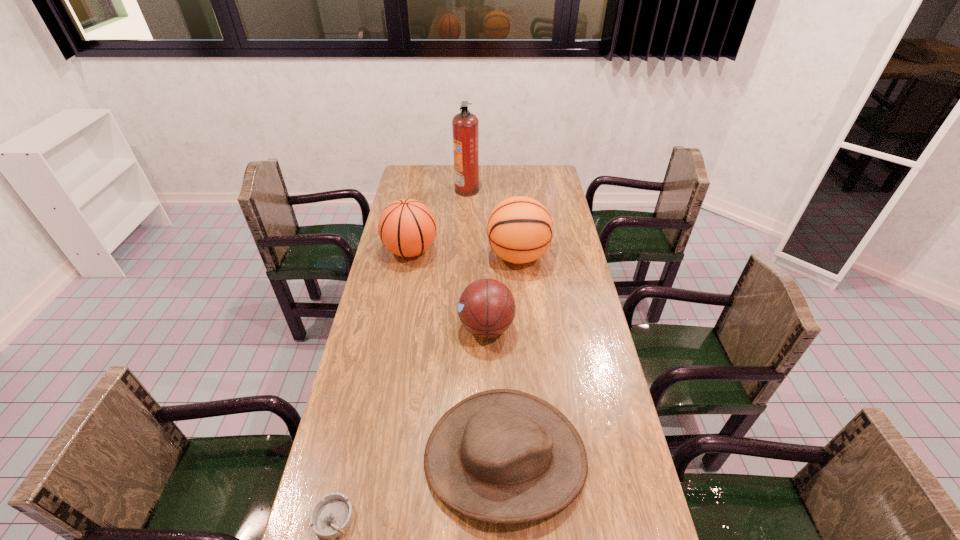
Where is `object situated at the far edge`? This screenshot has height=540, width=960. object situated at the far edge is located at coordinates (465, 126).

Where is `object that is at the left edge`? The height and width of the screenshot is (540, 960). object that is at the left edge is located at coordinates (407, 227).

The width and height of the screenshot is (960, 540). In order to click on basketball positioned at the right edge in this screenshot , I will do `click(520, 229)`.

In order to click on cowboy hat that is at the right edge in this screenshot , I will do `click(504, 456)`.

In the image, there is a desktop. Where is `vacant space at the far edge`? vacant space at the far edge is located at coordinates (498, 179).

This screenshot has height=540, width=960. In the image, there is a desktop. Identify the location of vacant region at the left edge. (402, 303).

In the image, there is a desktop. Where is `vacant region at the right edge`? The height and width of the screenshot is (540, 960). vacant region at the right edge is located at coordinates (593, 338).

I want to click on vacant region at the far left corner of the desktop, so click(x=407, y=175).

Identify the location of blank space at the far right corner of the desktop. (562, 189).

Image resolution: width=960 pixels, height=540 pixels. What are the coordinates of `free space that is in between the leftmost basketball and the nearest basketball` in the screenshot? It's located at (448, 289).